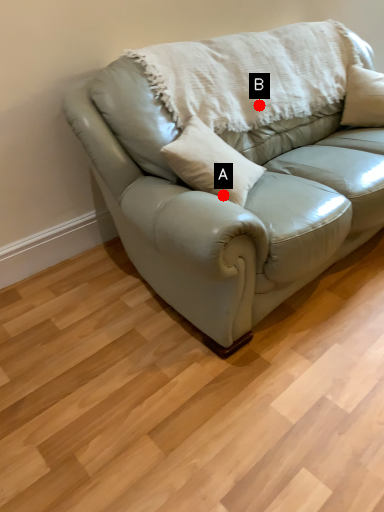
Question: Two points are circled on the image, labeled by A and B beside each circle. Which of the following is the closest to the observer?

Choices:
 (A) A is closer
 (B) B is closer

Answer: (A)